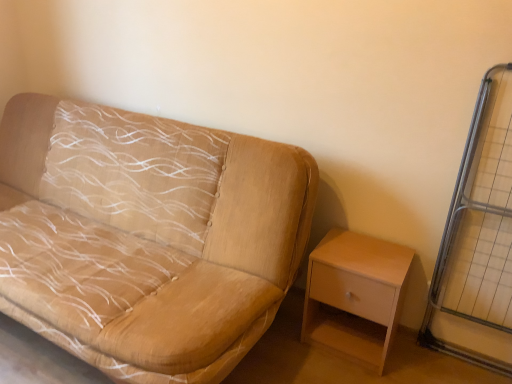
Question: Would you say metal grid at right is inside or outside light wood/wooden nightstand at lower right?

Choices:
 (A) inside
 (B) outside

Answer: (B)

Question: From a real-world perspective, is metal grid at right positioned above or below light wood/wooden nightstand at lower right?

Choices:
 (A) above
 (B) below

Answer: (A)

Question: Estimate the real-world distances between objects in this image. Which object is farther from the beige fabric couch at left?

Choices:
 (A) light wood/wooden nightstand at lower right
 (B) metal grid at right

Answer: (B)

Question: Which of these objects is positioned farthest from the light wood/wooden nightstand at lower right?

Choices:
 (A) metal grid at right
 (B) beige fabric couch at left

Answer: (B)